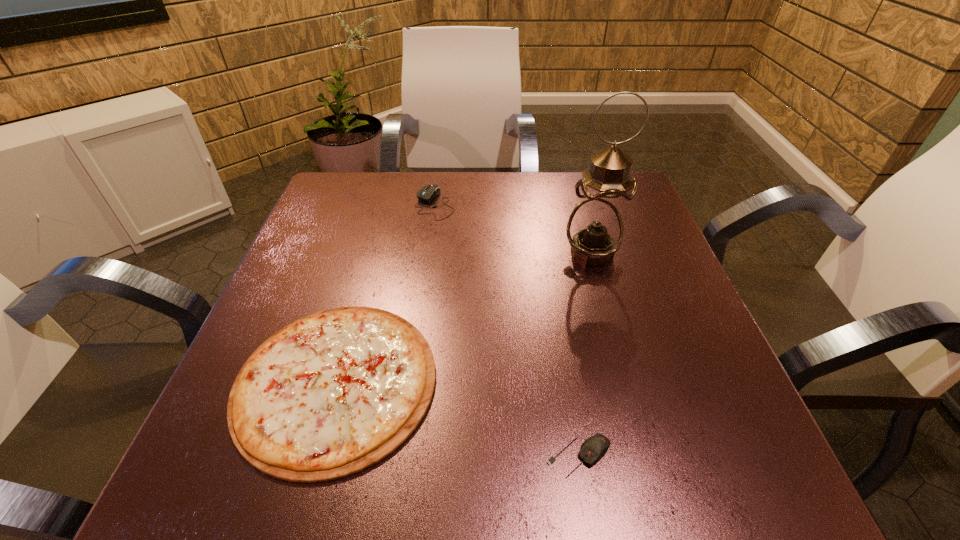
At what (x,y) coordinates should I click in order to perform the action: click on vacant point at the far left corner. Please return your answer as a coordinate pair (x, y). Image resolution: width=960 pixels, height=540 pixels. Looking at the image, I should click on (368, 195).

In the image, there is a desktop. At what (x,y) coordinates should I click in order to perform the action: click on vacant space at the near left corner. Please return your answer as a coordinate pair (x, y). This screenshot has width=960, height=540. Looking at the image, I should click on click(201, 451).

Image resolution: width=960 pixels, height=540 pixels. In order to click on blank space at the far right corner of the desktop in this screenshot , I will do `click(637, 193)`.

Locate an element on the screen. vacant area that lies between the oil lamp and the nearer mouse is located at coordinates (586, 355).

Locate an element on the screen. vacant region between the third shortest object and the shorter mouse is located at coordinates (507, 330).

Where is `vacant space in between the second farthest object and the pizza`? This screenshot has width=960, height=540. vacant space in between the second farthest object and the pizza is located at coordinates (464, 317).

Identify the location of free space between the farthest object and the oil lamp. (514, 228).

Locate an element on the screen. The image size is (960, 540). empty location between the farthest object and the second farthest object is located at coordinates (514, 228).

The height and width of the screenshot is (540, 960). What are the coordinates of `unoccupied position between the right mouse and the third shortest object` in the screenshot? It's located at (507, 330).

Where is `empty location between the tallest object and the left mouse`? empty location between the tallest object and the left mouse is located at coordinates (514, 228).